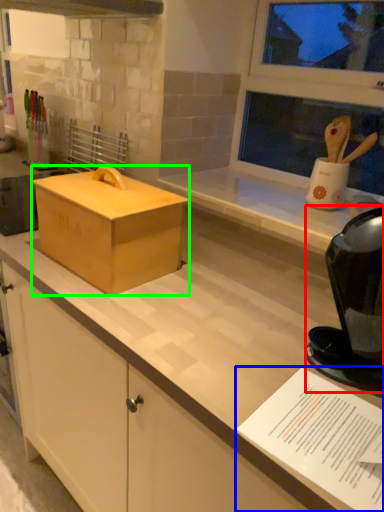
Question: Which is nearer to the appliance (highlighted by a red box)? paper (highlighted by a blue box) or box (highlighted by a green box).

Choices:
 (A) paper
 (B) box

Answer: (A)